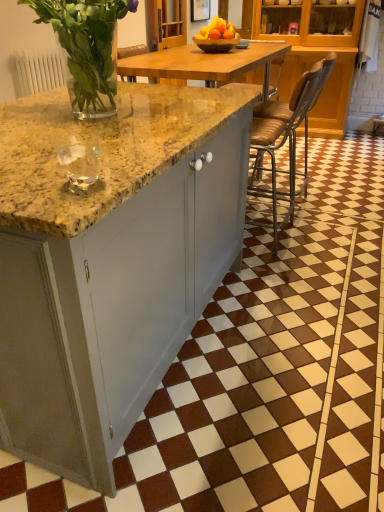
What are the coordinates of `vacant space underneath metallic brown bar stool at center (from a real-world perspective)` in the screenshot? It's located at (271, 233).